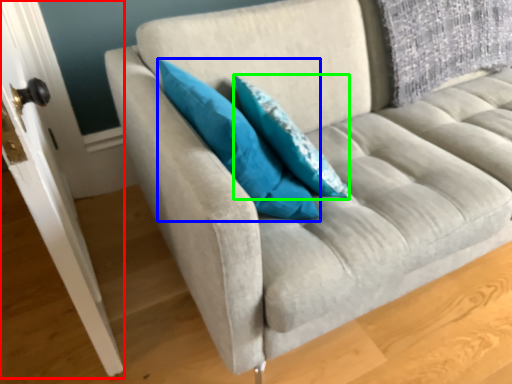
Question: Considering the real-world distances, which object is closest to door (highlighted by a red box)? pillow (highlighted by a blue box) or pillow (highlighted by a green box).

Choices:
 (A) pillow
 (B) pillow

Answer: (A)